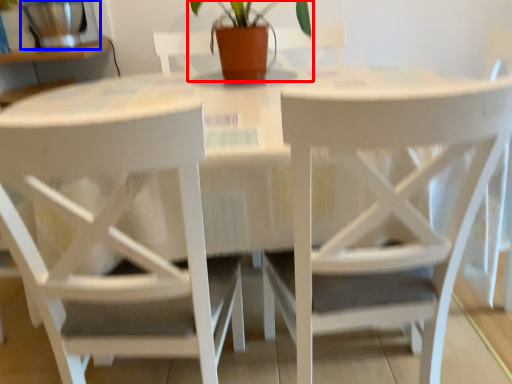
Question: Which object appears farthest to the camera in this image, houseplant (highlighted by a red box) or appliance (highlighted by a blue box)?

Choices:
 (A) houseplant
 (B) appliance

Answer: (B)